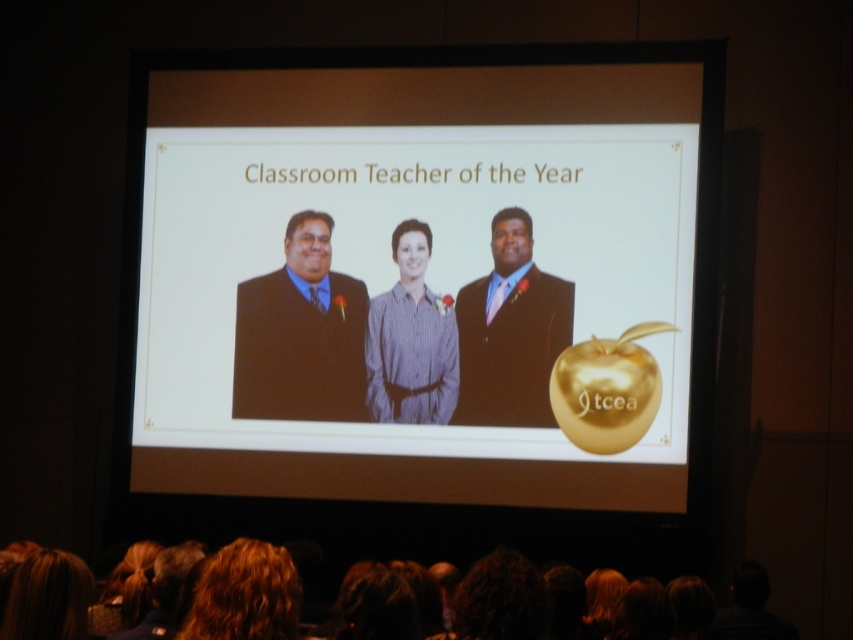
Locate an element on the screen. The width and height of the screenshot is (853, 640). curly brown hair at lower center is located at coordinates (245, 595).

Measure the distance between curly brown hair at lower center and camera.

3.97 meters

At what (x,y) coordinates should I click in order to perform the action: click on curly brown hair at lower center. Please return your answer as a coordinate pair (x, y). Looking at the image, I should click on (245, 595).

Is blue striped shirt at center to the right of curly brown hair at lower center from the viewer's perspective?

Indeed, blue striped shirt at center is positioned on the right side of curly brown hair at lower center.

Describe the element at coordinates (410, 340) in the screenshot. I see `blue striped shirt at center` at that location.

Locate an element on the screen. The image size is (853, 640). blue striped shirt at center is located at coordinates point(410,340).

Which is in front, point (144, 268) or point (474, 285)?

Point (474, 285)

Who is shorter, white paper at center or brown suit at center?

Standing shorter between the two is white paper at center.

This screenshot has width=853, height=640. What do you see at coordinates (424, 275) in the screenshot?
I see `white paper at center` at bounding box center [424, 275].

The width and height of the screenshot is (853, 640). I want to click on white paper at center, so click(424, 275).